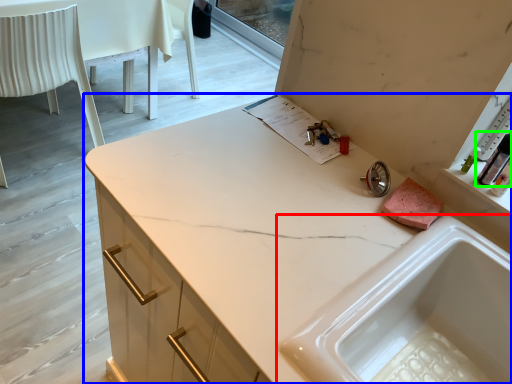
Question: Considering the real-world distances, which object is closest to sink (highlighted by a red box)? countertop (highlighted by a blue box) or toiletry (highlighted by a green box).

Choices:
 (A) countertop
 (B) toiletry

Answer: (A)